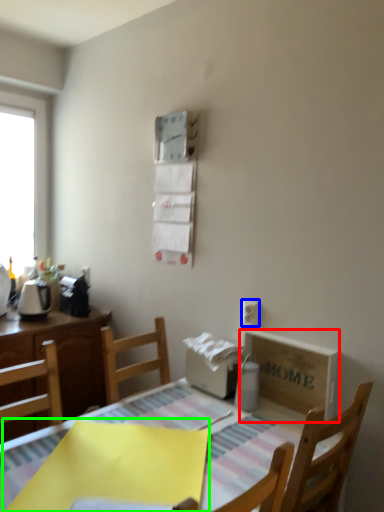
Question: Considering the real-world distances, which object is farthest from cardboard box (highlighted by a red box)? electric outlet (highlighted by a blue box) or cloth (highlighted by a green box)?

Choices:
 (A) electric outlet
 (B) cloth

Answer: (B)